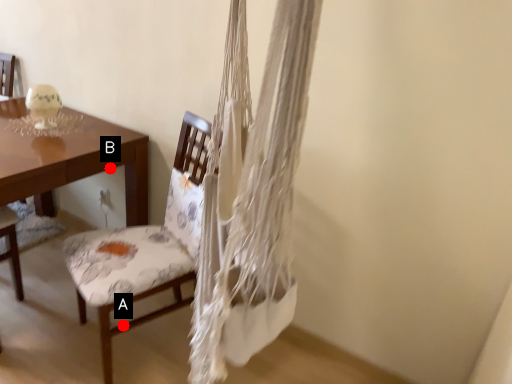
Question: Two points are circled on the image, labeled by A and B beside each circle. Among these points, which one is nearest to the camera?

Choices:
 (A) A is closer
 (B) B is closer

Answer: (A)